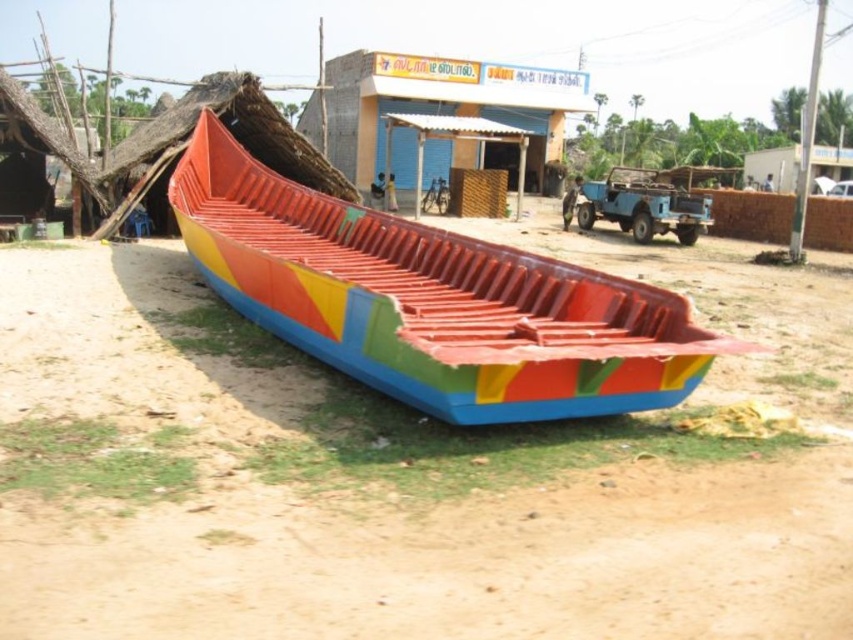
Who is higher up, dirt field at center or matte blue building at center?

Positioned higher is matte blue building at center.

Can you confirm if dirt field at center is positioned to the left of matte blue building at center?

Correct, you'll find dirt field at center to the left of matte blue building at center.

Locate an element on the screen. This screenshot has width=853, height=640. dirt field at center is located at coordinates (419, 504).

Is dirt field at center above multicolored plastic boat at center?

Incorrect, dirt field at center is not positioned above multicolored plastic boat at center.

Can you confirm if dirt field at center is positioned to the left of multicolored plastic boat at center?

In fact, dirt field at center is to the right of multicolored plastic boat at center.

You are a GUI agent. You are given a task and a screenshot of the screen. Output one action in this format:
    pyautogui.click(x=<x>, y=<y>)
    Task: Click on the dirt field at center
    The height and width of the screenshot is (640, 853).
    Given the screenshot: What is the action you would take?
    pyautogui.click(x=419, y=504)

Who is more distant from viewer, (318,308) or (317,125)?

Point (317,125)

Locate an element on the screen. The width and height of the screenshot is (853, 640). multicolored plastic boat at center is located at coordinates pyautogui.click(x=431, y=300).

Find the location of a particular element. The image size is (853, 640). multicolored plastic boat at center is located at coordinates (431, 300).